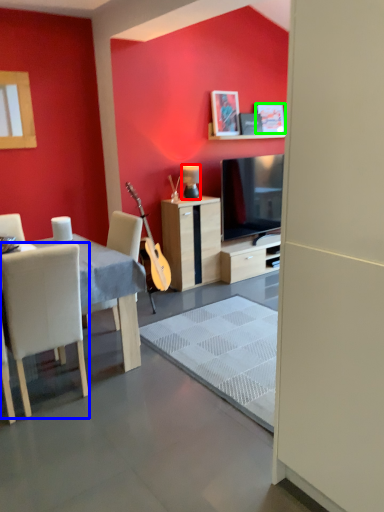
Question: Considering the real-world distances, which object is closest to lamp (highlighted by a red box)? chair (highlighted by a blue box) or picture frame (highlighted by a green box).

Choices:
 (A) chair
 (B) picture frame

Answer: (B)